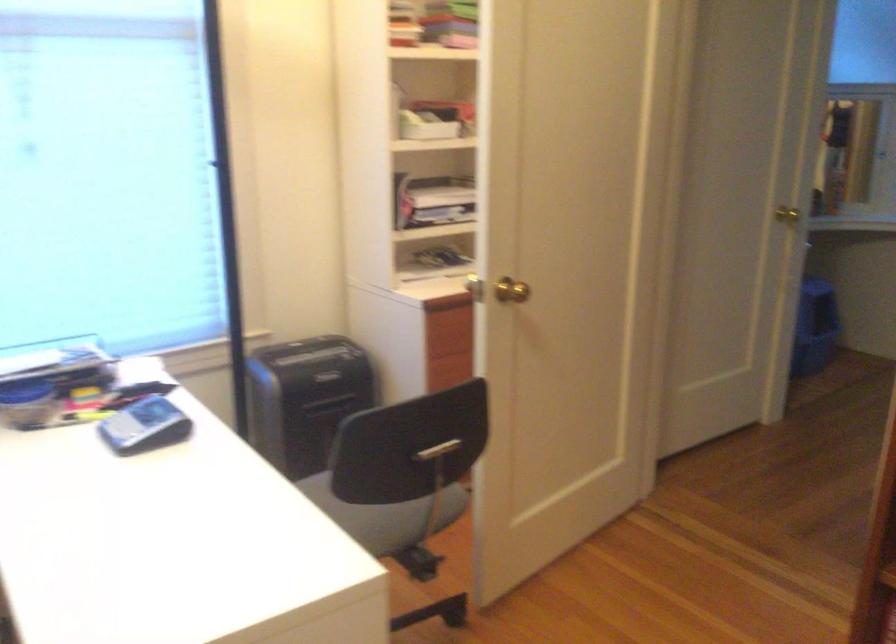
At what (x,y) coordinates should I click in order to perform the action: click on grey calculator. Please return your answer as a coordinate pair (x, y). The width and height of the screenshot is (896, 644). Looking at the image, I should click on (143, 426).